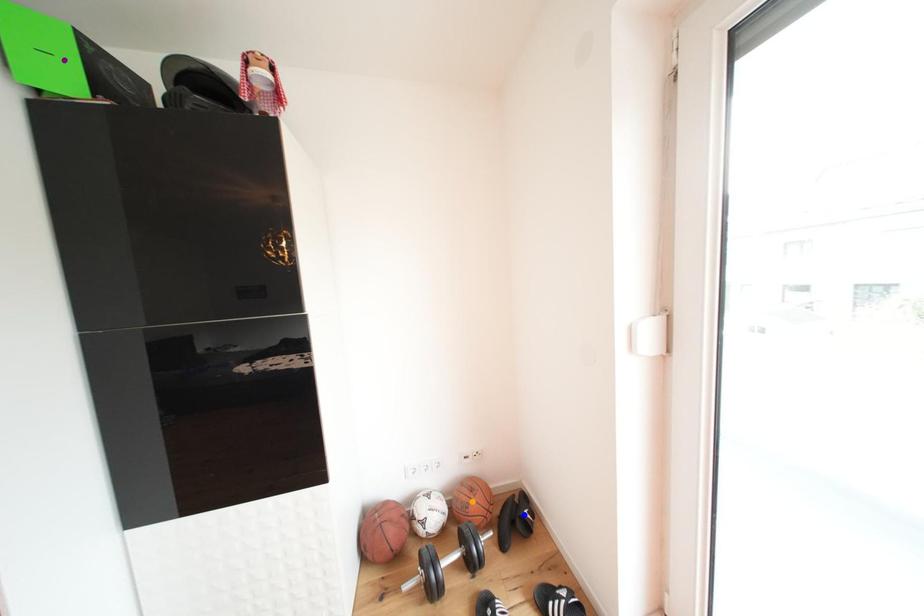
Order these from nearest to farthest:
1. purple point
2. orange point
3. blue point

purple point
orange point
blue point